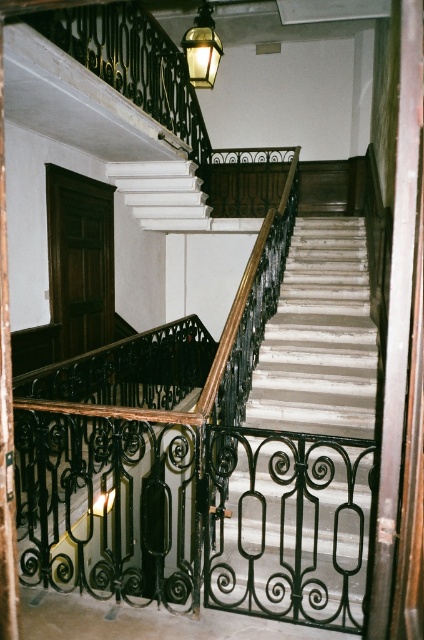
Question: Which point appears closest to the camera in this image?

Choices:
 (A) (331, 282)
 (B) (209, 65)

Answer: (B)

Question: Among these objects, which one is farthest from the camera?

Choices:
 (A) white marble stairs at center
 (B) matte brass lantern at upper center

Answer: (B)

Question: Does white marble stairs at center appear over matte brass lantern at upper center?

Choices:
 (A) yes
 (B) no

Answer: (B)

Question: In this image, where is white marble stairs at center located relative to matte brass lantern at upper center?

Choices:
 (A) left
 (B) right

Answer: (B)

Question: Which point is farther from the camera taking this photo?

Choices:
 (A) (300, 618)
 (B) (189, 48)

Answer: (B)

Question: Is white marble stairs at center to the left of matte brass lantern at upper center from the viewer's perspective?

Choices:
 (A) yes
 (B) no

Answer: (B)